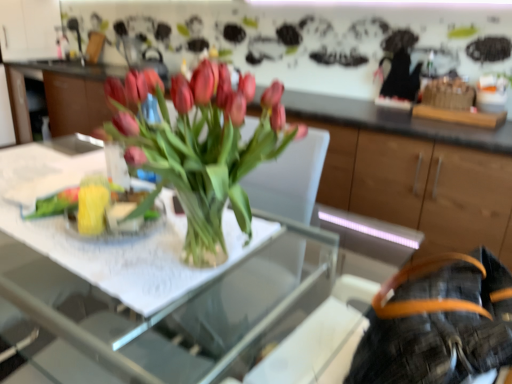
Question: Does orange leather belt at lower right turn towards clear glass vase at center?

Choices:
 (A) no
 (B) yes

Answer: (B)

Question: Can you confirm if orange leather belt at lower right is positioned to the right of clear glass vase at center?

Choices:
 (A) no
 (B) yes

Answer: (B)

Question: Does orange leather belt at lower right have a greater height compared to clear glass vase at center?

Choices:
 (A) no
 (B) yes

Answer: (B)

Question: From the image's perspective, would you say orange leather belt at lower right is positioned over clear glass vase at center?

Choices:
 (A) yes
 (B) no

Answer: (B)

Question: Is orange leather belt at lower right further to camera compared to clear glass vase at center?

Choices:
 (A) yes
 (B) no

Answer: (B)

Question: Relative to clear glass vase at center, is clear glass table at center in front or behind?

Choices:
 (A) front
 (B) behind

Answer: (A)

Question: Would you say clear glass table at center is to the left or to the right of clear glass vase at center in the picture?

Choices:
 (A) left
 (B) right

Answer: (B)

Question: In terms of height, does clear glass table at center look taller or shorter compared to clear glass vase at center?

Choices:
 (A) tall
 (B) short

Answer: (A)

Question: From a real-world perspective, is clear glass table at center positioned above or below clear glass vase at center?

Choices:
 (A) below
 (B) above

Answer: (A)

Question: From a real-world perspective, is clear glass vase at center positioned above or below orange leather belt at lower right?

Choices:
 (A) above
 (B) below

Answer: (A)

Question: Do you think clear glass vase at center is within orange leather belt at lower right, or outside of it?

Choices:
 (A) outside
 (B) inside

Answer: (A)

Question: From the image's perspective, is clear glass vase at center above or below orange leather belt at lower right?

Choices:
 (A) above
 (B) below

Answer: (A)

Question: Considering the positions of clear glass vase at center and orange leather belt at lower right in the image, is clear glass vase at center taller or shorter than orange leather belt at lower right?

Choices:
 (A) tall
 (B) short

Answer: (B)

Question: Considering the relative positions of orange leather belt at lower right and clear glass vase at center in the image provided, is orange leather belt at lower right to the left or to the right of clear glass vase at center?

Choices:
 (A) right
 (B) left

Answer: (A)

Question: Is orange leather belt at lower right inside the boundaries of clear glass vase at center, or outside?

Choices:
 (A) outside
 (B) inside

Answer: (A)